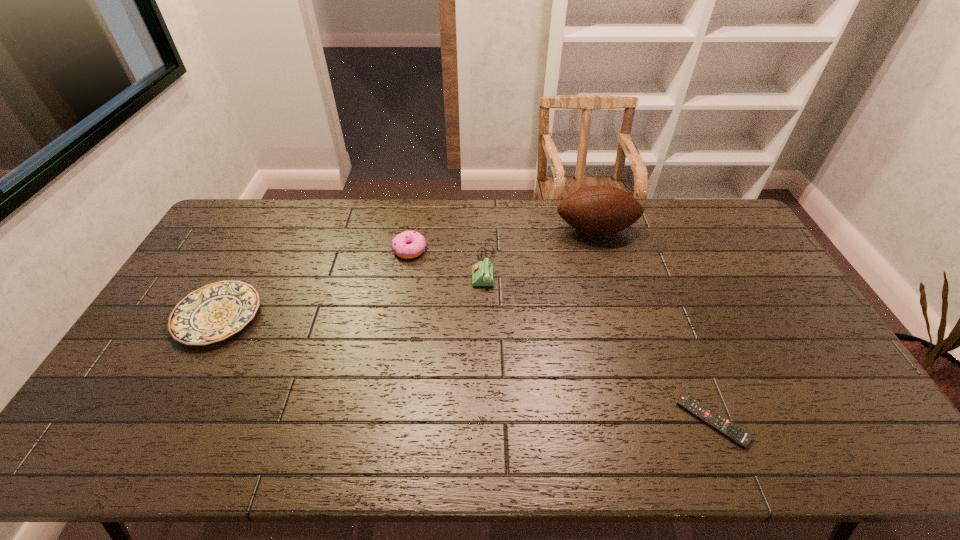
Where is `vacant space situated on the dial of the third object from left to right`? The width and height of the screenshot is (960, 540). vacant space situated on the dial of the third object from left to right is located at coordinates (457, 268).

You are a GUI agent. You are given a task and a screenshot of the screen. Output one action in this format:
    pyautogui.click(x=<x>, y=<y>)
    Task: Click on the blank space located on the right of the doughnut
    Image resolution: width=960 pixels, height=540 pixels.
    Given the screenshot: What is the action you would take?
    pyautogui.click(x=487, y=249)

I want to click on vacant space located on the back of the plate, so click(x=248, y=263).

Find the location of `vacant space located 0.240m on the left of the nearest object`. vacant space located 0.240m on the left of the nearest object is located at coordinates (583, 421).

You are a GUI agent. You are given a task and a screenshot of the screen. Output one action in this format:
    pyautogui.click(x=<x>, y=<y>)
    Task: Click on the football that is positioned at the far edge
    The width and height of the screenshot is (960, 540).
    Given the screenshot: What is the action you would take?
    pyautogui.click(x=600, y=210)

You are a GUI agent. You are given a task and a screenshot of the screen. Output one action in this format:
    pyautogui.click(x=<x>, y=<y>)
    Task: Click on the doughnut that is at the far edge
    The height and width of the screenshot is (540, 960).
    Given the screenshot: What is the action you would take?
    pyautogui.click(x=409, y=244)

Identify the location of object located at the near edge. This screenshot has height=540, width=960. (724, 426).

Locate an element on the screen. This screenshot has height=540, width=960. object present at the left edge is located at coordinates (212, 313).

Identify the location of vacant space at the far edge of the desktop. The image size is (960, 540). (458, 230).

Find the location of a particular element. blank area at the near edge is located at coordinates (161, 453).